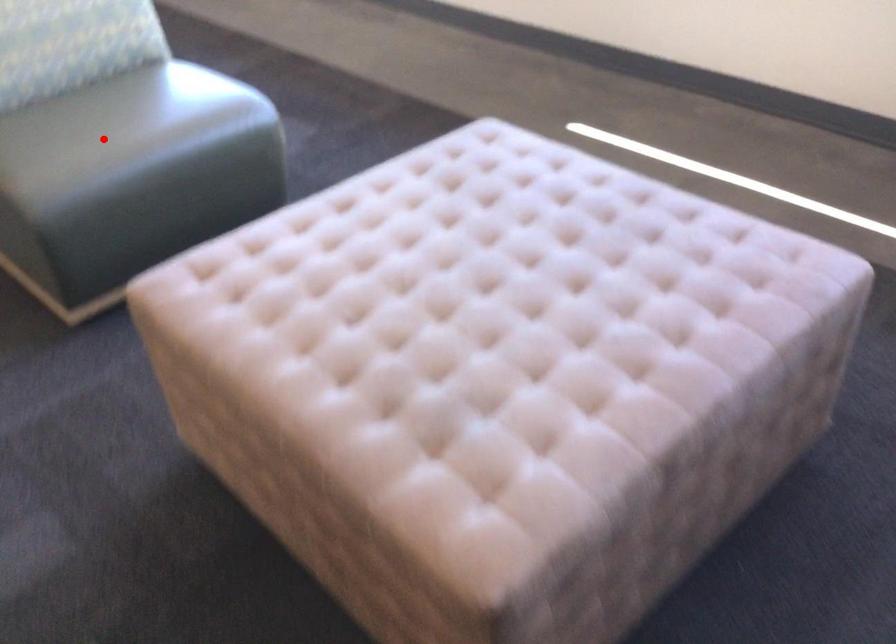
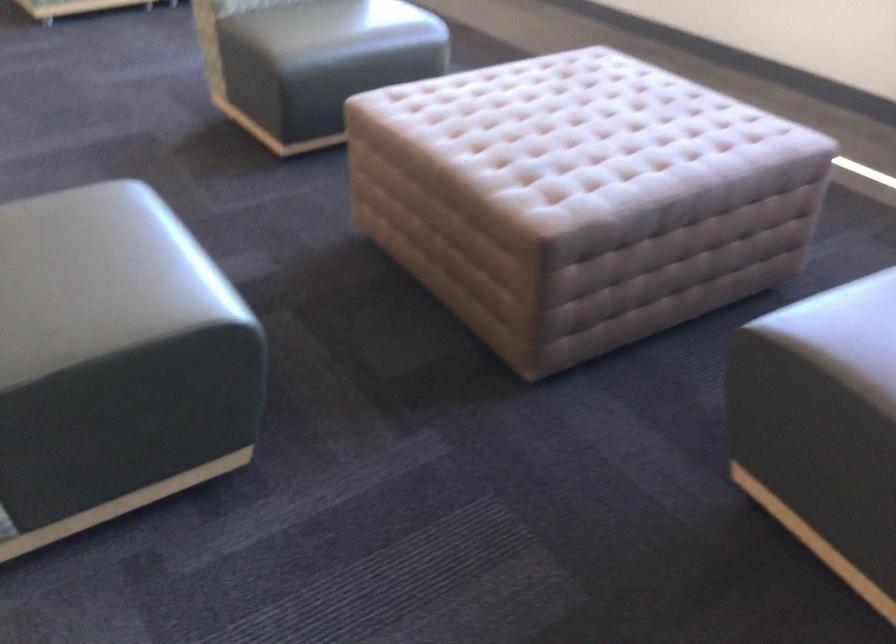
Question: I am providing you with two images of the same scene from different viewpoints. In image1, a red point is highlighted. Considering the same 3D point in image2, which of the following is correct?

Choices:
 (A) It is closer
 (B) It is farther

Answer: (B)